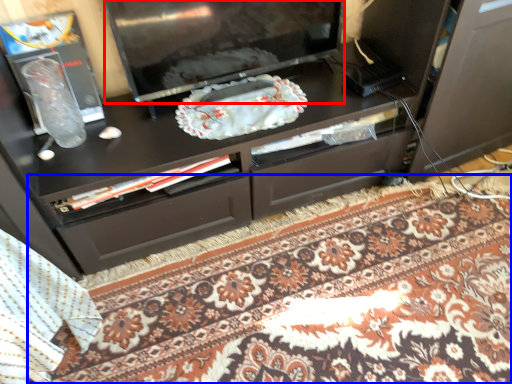
Question: Which of the following is the closest to the observer, television (highlighted by a red box) or mat (highlighted by a blue box)?

Choices:
 (A) television
 (B) mat

Answer: (B)